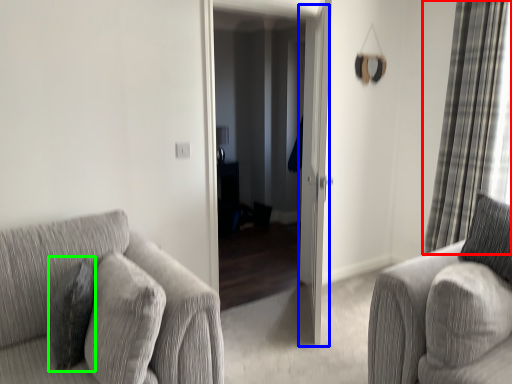
Question: Based on their relative distances, which object is farther from curtain (highlighted by a red box)? Choose from screen door (highlighted by a blue box) and pillow (highlighted by a green box).

Choices:
 (A) screen door
 (B) pillow

Answer: (B)